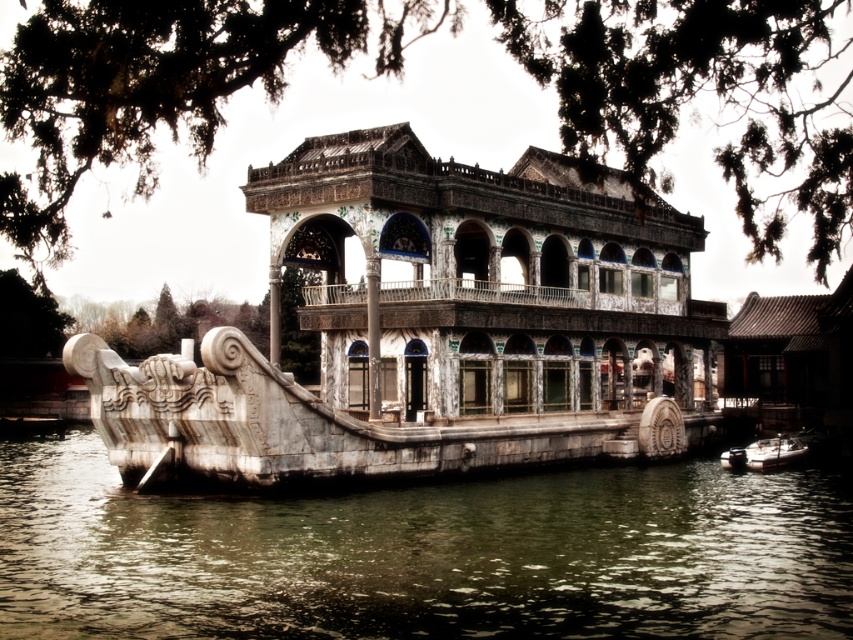
Question: Is greenish water at lower center bigger than metallic silver boat at lower right?

Choices:
 (A) yes
 (B) no

Answer: (A)

Question: Is greenish water at lower center positioned behind metallic silver boat at lower right?

Choices:
 (A) no
 (B) yes

Answer: (A)

Question: Which point is farther from the camera taking this photo?

Choices:
 (A) (766, 456)
 (B) (461, 621)

Answer: (A)

Question: Where is greenish water at lower center located in relation to metallic silver boat at lower right in the image?

Choices:
 (A) below
 (B) above

Answer: (A)

Question: Which point appears farthest from the camera in this image?

Choices:
 (A) (750, 596)
 (B) (776, 440)

Answer: (B)

Question: Which point is farther to the camera?

Choices:
 (A) greenish water at lower center
 (B) metallic silver boat at lower right

Answer: (B)